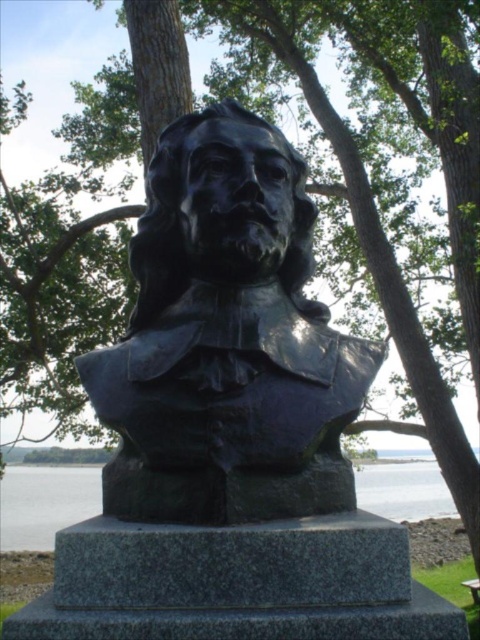
You are standing in front of the bronze bust sculpture on the granite pedestal. There are two points marked in the image. The first point is at coordinates point (251,202) and the second point is at point (411,490). Which point is closer to you?

Point (251,202) is in front of point (411,490), so the first point is closer to you.

You are a landscape architect designing a garden around the black polished bust at center and the transparent water at base center. Based on their sizes, which object should you consider placing closer to visitors for better visibility?

The black polished bust at center is smaller in size compared to the transparent water at base center, so it should be placed closer to visitors to ensure it is easily visible.